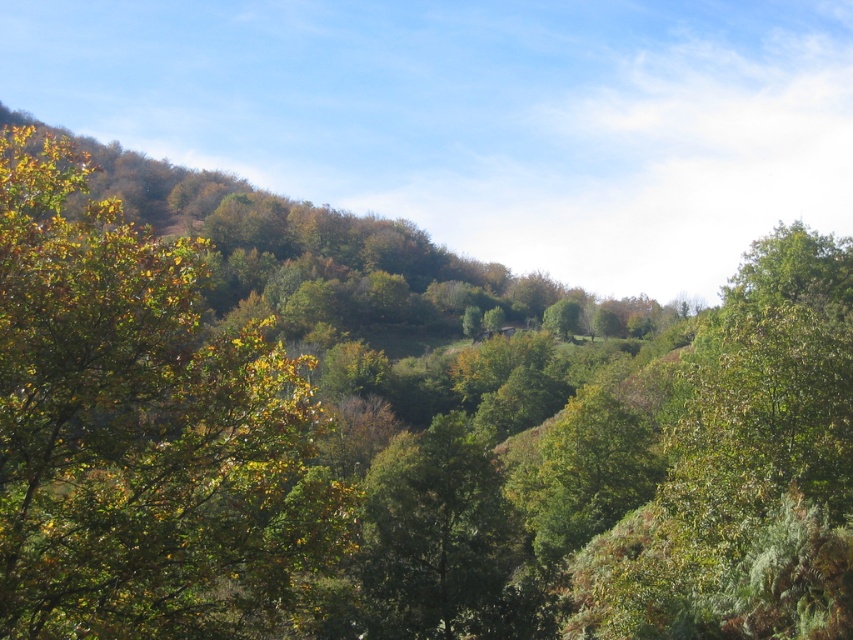
Identify the location of green leafy tree at left. (141, 429).

In order to click on green leafy tree at left in this screenshot , I will do `click(141, 429)`.